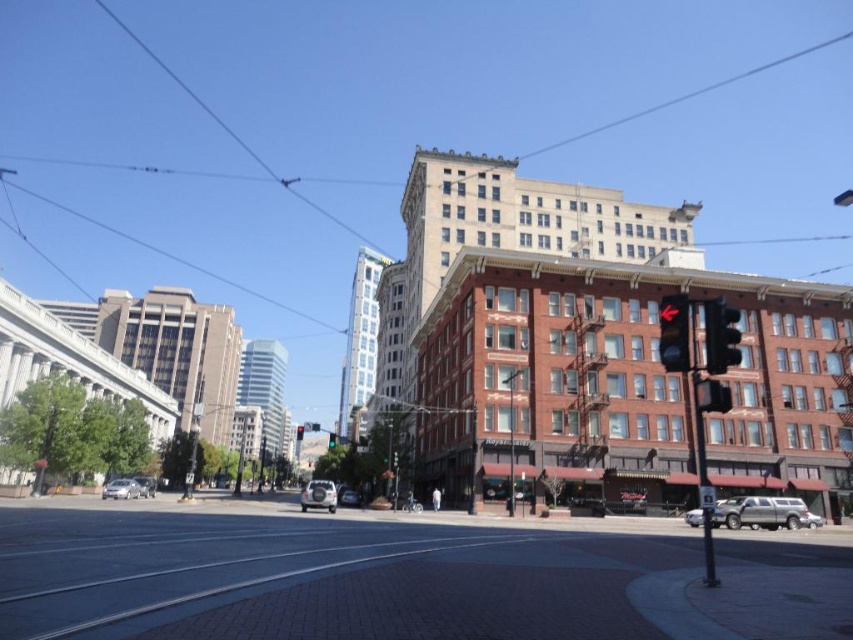
Question: Which of the following is the closest to the observer?

Choices:
 (A) silver metallic suv at center
 (B) silver metallic car at lower left
 (C) metallic traffic light at center right

Answer: (C)

Question: Does brick pavement at center have a lesser width compared to silver metallic car at center?

Choices:
 (A) no
 (B) yes

Answer: (A)

Question: Considering the real-world distances, which object is farthest from the silver metallic suv at center?

Choices:
 (A) black glass traffic light at right
 (B) metallic traffic light at center right

Answer: (B)

Question: Can you confirm if silver metallic suv at lower right is thinner than green glass traffic light at center?

Choices:
 (A) yes
 (B) no

Answer: (A)

Question: Considering the relative positions of silver metallic car at lower left and silver metallic suv at center in the image provided, where is silver metallic car at lower left located with respect to silver metallic suv at center?

Choices:
 (A) above
 (B) below

Answer: (A)

Question: Which of the following is the closest to the observer?

Choices:
 (A) (740, 506)
 (B) (113, 488)
 (C) (346, 499)
 (D) (332, 440)

Answer: (A)